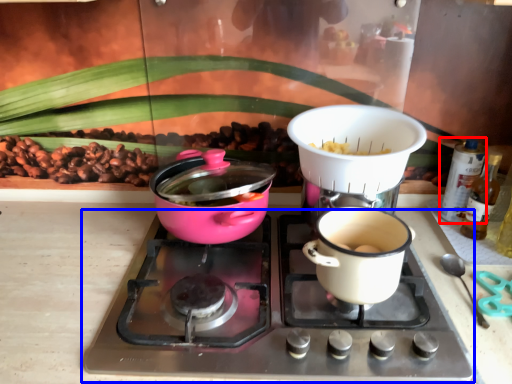
Question: Which of the following is the farthest to the observer, bottle (highlighted by a red box) or gas stove (highlighted by a blue box)?

Choices:
 (A) bottle
 (B) gas stove

Answer: (A)